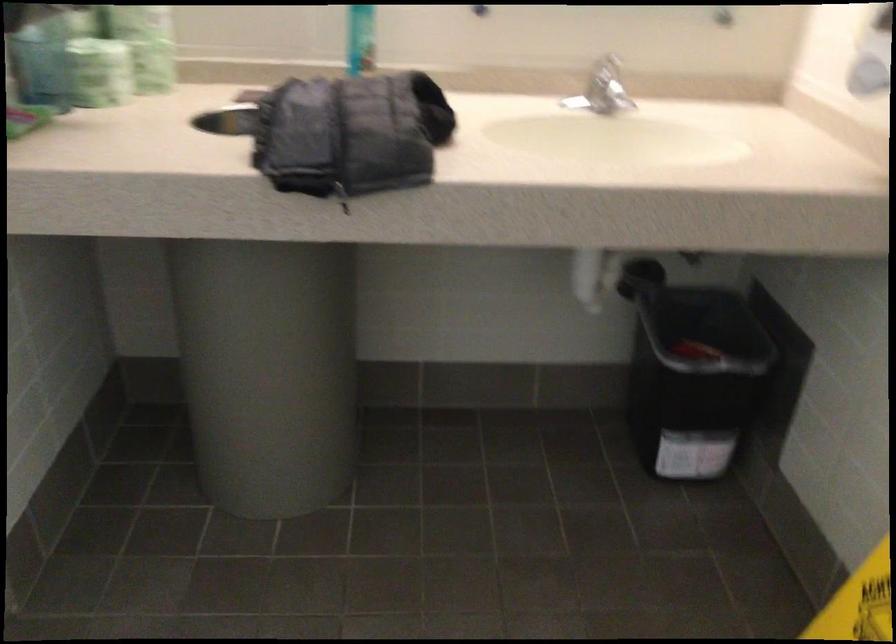
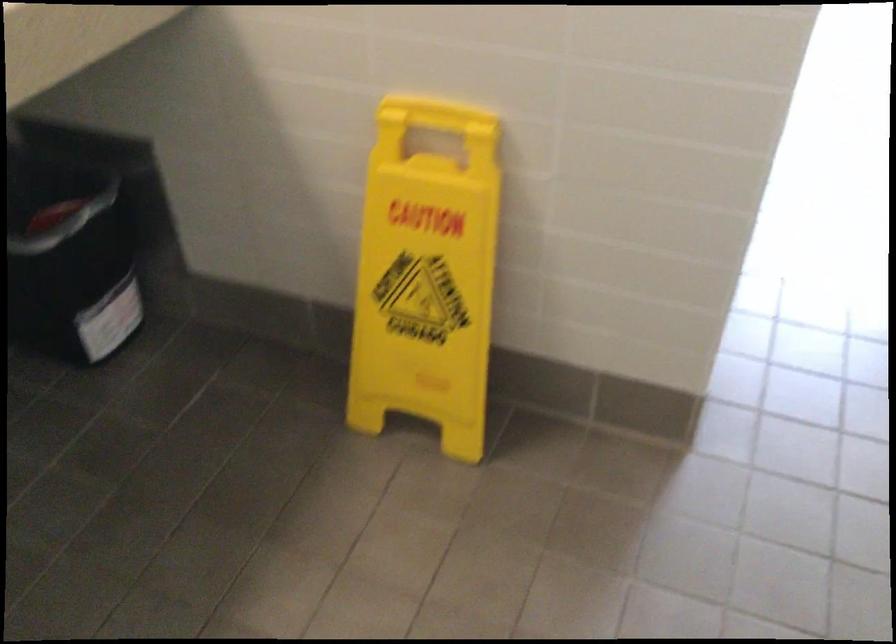
The images are taken continuously from a first-person perspective. In which direction is your viewpoint rotating?

The camera rotated toward right-down.